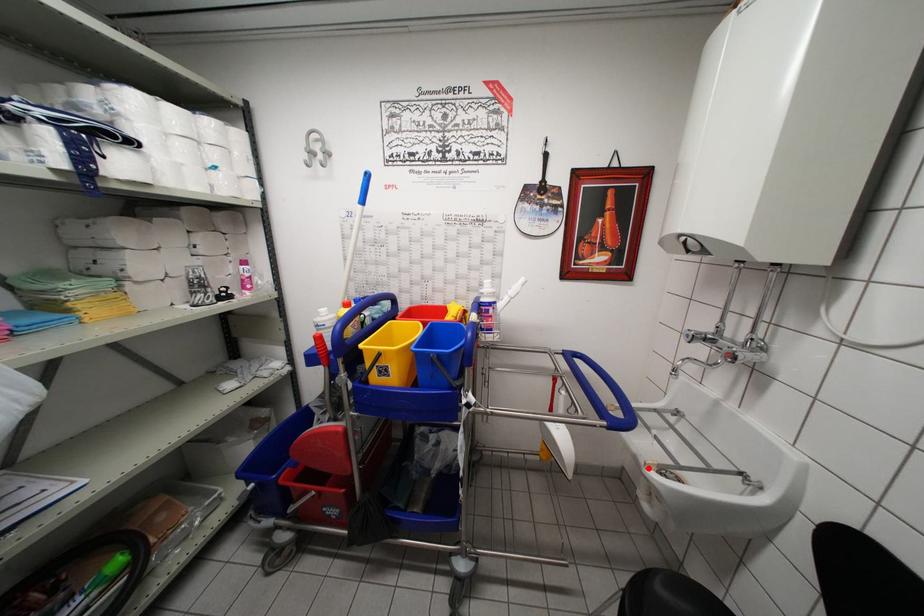
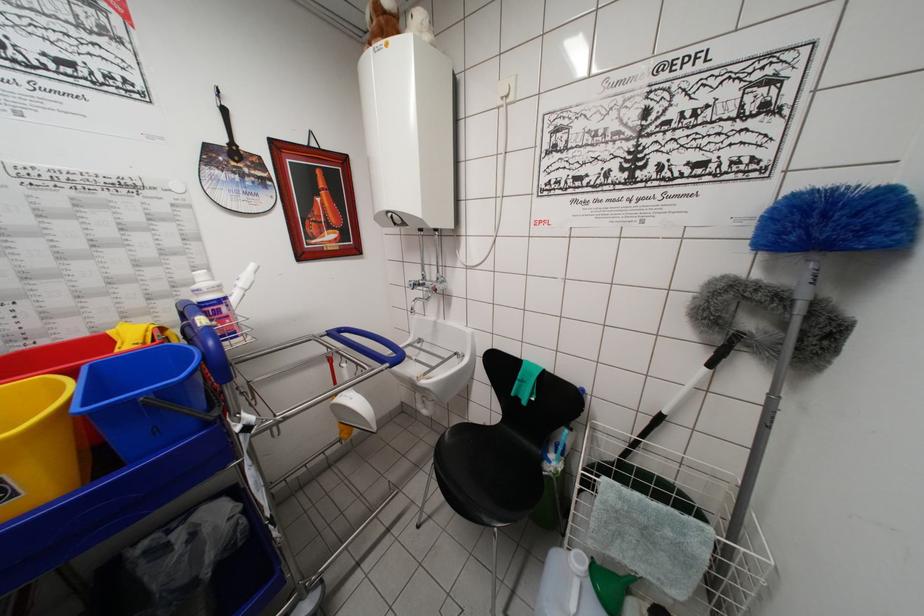
Question: I am providing you with two images of the same scene from different viewpoints. Image1 has a red point marked. In image2, the corresponding 3D location appears at what relative position? Reply with the corresponding letter.

Choices:
 (A) Closer
 (B) Farther

Answer: (B)